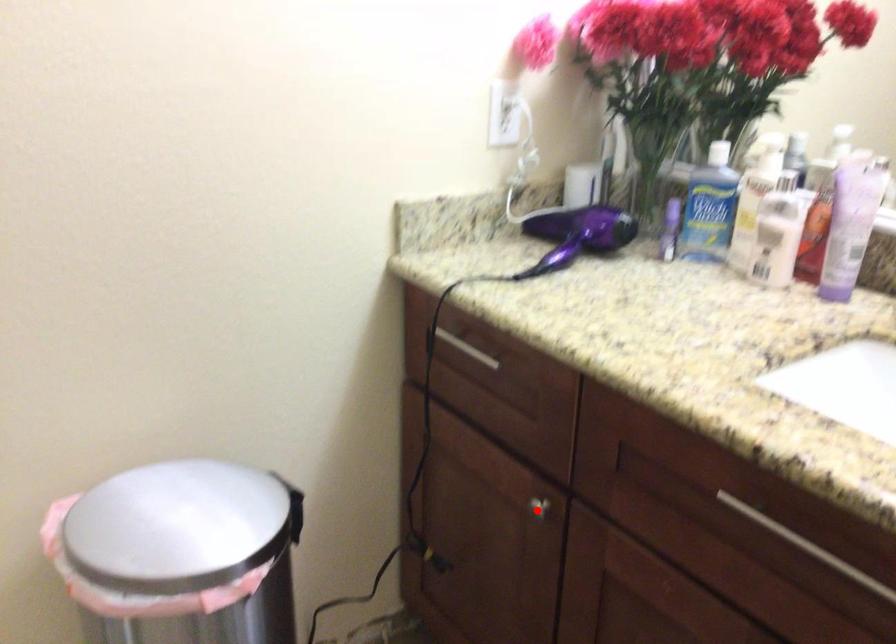
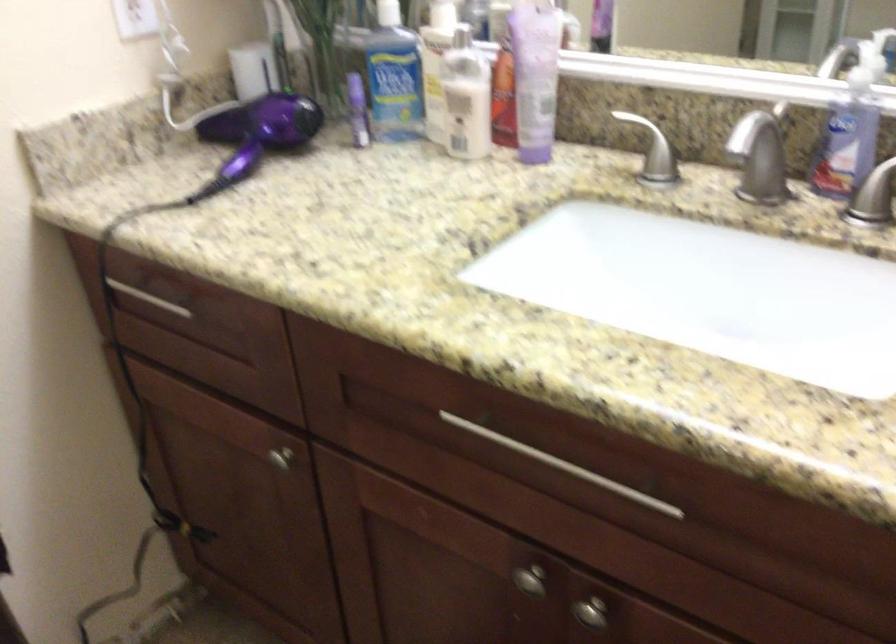
Question: I am providing you with two images of the same scene from different viewpoints. Image1 has a red point marked. In image2, the corresponding 3D location appears at what relative position? Reply with the corresponding letter.

Choices:
 (A) Closer
 (B) Farther

Answer: (A)